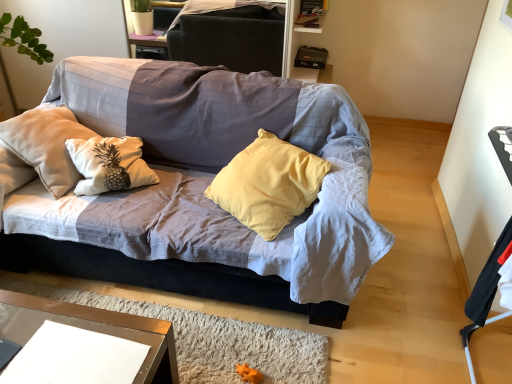
The image size is (512, 384). What do you see at coordinates (295, 45) in the screenshot?
I see `dark gray fabric dresser at upper center` at bounding box center [295, 45].

The height and width of the screenshot is (384, 512). What do you see at coordinates (93, 330) in the screenshot? I see `clear glass table at lower left` at bounding box center [93, 330].

What is the approximate height of textured fabric couch at center?

textured fabric couch at center is 81.43 centimeters in height.

The height and width of the screenshot is (384, 512). In order to click on black fabric armchair at right in this screenshot , I will do `click(486, 291)`.

The image size is (512, 384). Identify the location of dresser on the left of the black fabric armchair at right. (295, 45).

Are black fabric armchair at right and dark gray fabric dresser at upper center beside each other?

No, black fabric armchair at right is not beside dark gray fabric dresser at upper center.

In terms of height, does black fabric armchair at right look taller or shorter compared to dark gray fabric dresser at upper center?

black fabric armchair at right is taller than dark gray fabric dresser at upper center.

Which object is positioned more to the right, clear glass table at lower left or textured fabric couch at center?

Positioned to the right is textured fabric couch at center.

Is clear glass table at lower left in front of or behind textured fabric couch at center in the image?

clear glass table at lower left is in front of textured fabric couch at center.

Is clear glass table at lower left thinner than textured fabric couch at center?

Correct, the width of clear glass table at lower left is less than that of textured fabric couch at center.

Is clear glass table at lower left facing towards textured fabric couch at center?

No.

Does clear glass table at lower left touch dark gray fabric dresser at upper center?

No, clear glass table at lower left is not in contact with dark gray fabric dresser at upper center.

Which is more to the right, clear glass table at lower left or dark gray fabric dresser at upper center?

From the viewer's perspective, dark gray fabric dresser at upper center appears more on the right side.

Looking at their sizes, would you say clear glass table at lower left is wider or thinner than dark gray fabric dresser at upper center?

Considering their sizes, clear glass table at lower left looks broader than dark gray fabric dresser at upper center.

Is clear glass table at lower left not inside dark gray fabric dresser at upper center?

Yes.

Is textured fabric couch at center surrounding dark gray fabric dresser at upper center?

No, textured fabric couch at center does not contain dark gray fabric dresser at upper center.

Is textured fabric couch at center at the right side of dark gray fabric dresser at upper center?

Correct, you'll find textured fabric couch at center to the right of dark gray fabric dresser at upper center.

Considering the relative sizes of textured fabric couch at center and dark gray fabric dresser at upper center in the image provided, is textured fabric couch at center taller than dark gray fabric dresser at upper center?

Indeed, textured fabric couch at center has a greater height compared to dark gray fabric dresser at upper center.

Could you tell me if textured fabric couch at center is facing dark gray fabric dresser at upper center?

No, textured fabric couch at center is not turned towards dark gray fabric dresser at upper center.

From a real-world perspective, is clear glass table at lower left under black fabric armchair at right?

Yes, from a real-world perspective, clear glass table at lower left is beneath black fabric armchair at right.

Between clear glass table at lower left and black fabric armchair at right, which one has less height?

Standing shorter between the two is clear glass table at lower left.

This screenshot has width=512, height=384. I want to click on armchair lying behind the clear glass table at lower left, so click(x=486, y=291).

Does clear glass table at lower left have a greater width compared to black fabric armchair at right?

Indeed, clear glass table at lower left has a greater width compared to black fabric armchair at right.

Is the position of textured fabric couch at center less distant than that of clear glass table at lower left?

No, it is not.

Considering the positions of point (365, 267) and point (172, 342), is point (365, 267) closer or farther from the camera than point (172, 342)?

Clearly, point (365, 267) is more distant from the camera than point (172, 342).

From a real-world perspective, between textured fabric couch at center and clear glass table at lower left, who is vertically lower?

clear glass table at lower left is physically lower.

Does point (298, 0) lie in front of point (328, 275)?

No, it is behind (328, 275).

From the picture: Can you confirm if dark gray fabric dresser at upper center is bigger than textured fabric couch at center?

No, dark gray fabric dresser at upper center is not bigger than textured fabric couch at center.

From the image's perspective, does dark gray fabric dresser at upper center appear higher than textured fabric couch at center?

Yes, from the image's perspective, dark gray fabric dresser at upper center is over textured fabric couch at center.

The image size is (512, 384). What are the coordinates of `armchair below the dark gray fabric dresser at upper center (from a real-world perspective)` in the screenshot? It's located at (486, 291).

The image size is (512, 384). What are the coordinates of `studio couch lying behind the clear glass table at lower left` in the screenshot? It's located at (204, 187).

Looking at this image, estimate the real-world distances between objects in this image. Which object is closer to clear glass table at lower left, textured fabric couch at center or dark gray fabric dresser at upper center?

Among the two, textured fabric couch at center is located nearer to clear glass table at lower left.

Estimate the real-world distances between objects in this image. Which object is further from textured fabric couch at center, black fabric armchair at right or dark gray fabric dresser at upper center?

Among the two, dark gray fabric dresser at upper center is located further to textured fabric couch at center.

Estimate the real-world distances between objects in this image. Which object is closer to dark gray fabric dresser at upper center, clear glass table at lower left or textured fabric couch at center?

The object closer to dark gray fabric dresser at upper center is textured fabric couch at center.

Estimate the real-world distances between objects in this image. Which object is further from textured fabric couch at center, black fabric armchair at right or clear glass table at lower left?

black fabric armchair at right.

Considering their positions, is dark gray fabric dresser at upper center positioned closer to black fabric armchair at right than textured fabric couch at center?

The object closer to black fabric armchair at right is textured fabric couch at center.

Looking at the image, which one is located further to textured fabric couch at center, dark gray fabric dresser at upper center or clear glass table at lower left?

dark gray fabric dresser at upper center is further to textured fabric couch at center.

Estimate the real-world distances between objects in this image. Which object is further from black fabric armchair at right, dark gray fabric dresser at upper center or clear glass table at lower left?

Among the two, dark gray fabric dresser at upper center is located further to black fabric armchair at right.

Considering their positions, is dark gray fabric dresser at upper center positioned closer to clear glass table at lower left than black fabric armchair at right?

Among the two, black fabric armchair at right is located nearer to clear glass table at lower left.

Where is `studio couch located between black fabric armchair at right and dark gray fabric dresser at upper center in the depth direction`? The height and width of the screenshot is (384, 512). studio couch located between black fabric armchair at right and dark gray fabric dresser at upper center in the depth direction is located at coordinates (204, 187).

Where is `armchair that lies between dark gray fabric dresser at upper center and clear glass table at lower left from top to bottom`? The image size is (512, 384). armchair that lies between dark gray fabric dresser at upper center and clear glass table at lower left from top to bottom is located at coordinates (486, 291).

The image size is (512, 384). Identify the location of studio couch situated between clear glass table at lower left and black fabric armchair at right from left to right. (204, 187).

The height and width of the screenshot is (384, 512). Find the location of `studio couch that lies between dark gray fabric dresser at upper center and clear glass table at lower left from top to bottom`. studio couch that lies between dark gray fabric dresser at upper center and clear glass table at lower left from top to bottom is located at coordinates (204, 187).